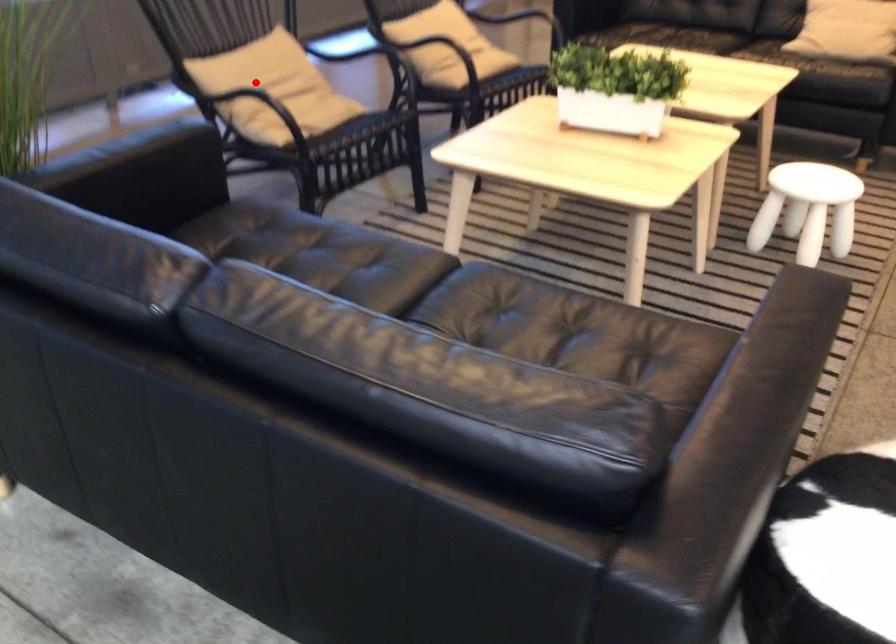
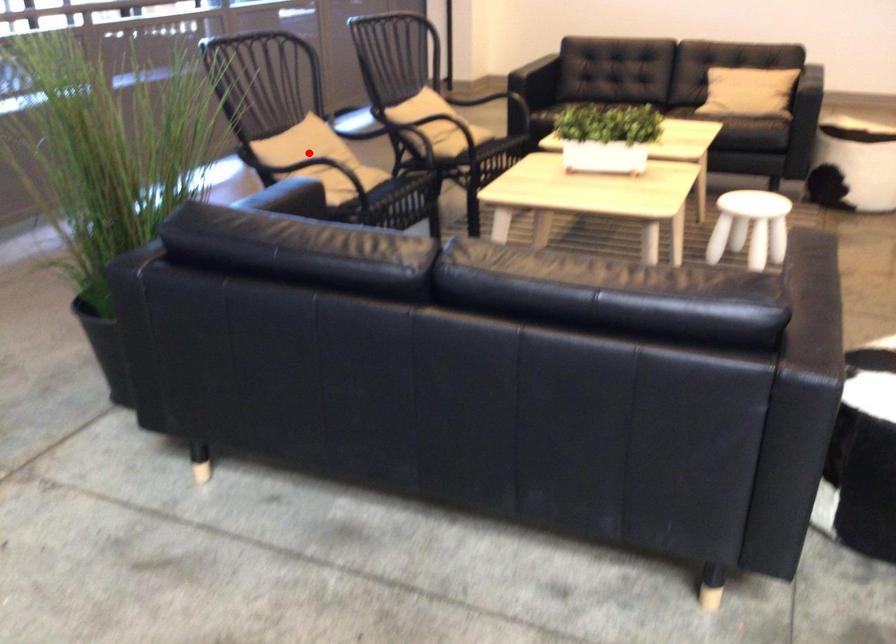
I am providing you with two images of the same scene from different viewpoints. A red point is marked on the first image and another point is marked on the second image. Are the points marked in image1 and image2 representing the same 3D position?

Yes